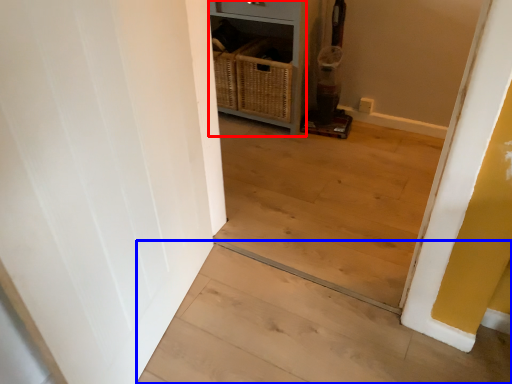
Question: Which of the following is the farthest to the observer, dresser (highlighted by a red box) or stairwell (highlighted by a blue box)?

Choices:
 (A) dresser
 (B) stairwell

Answer: (A)